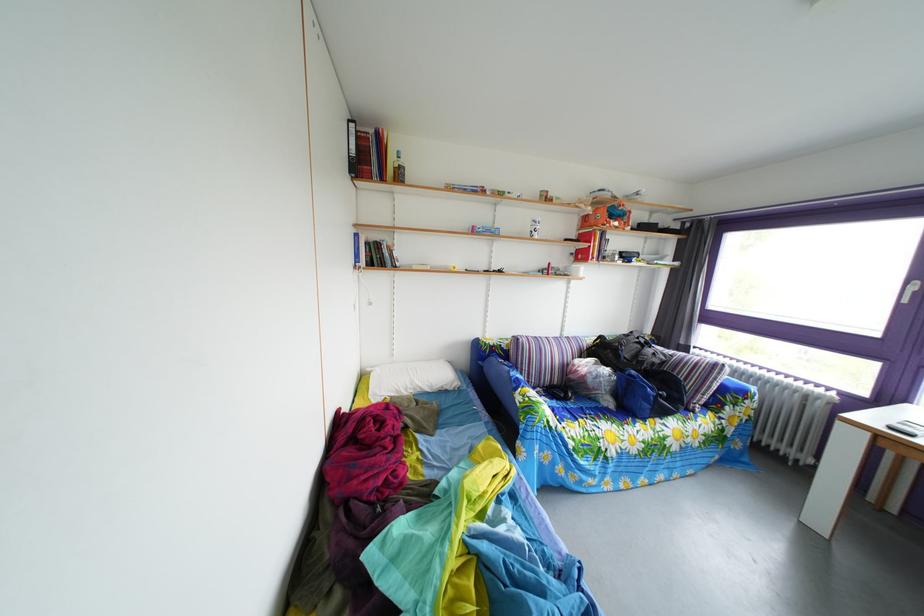
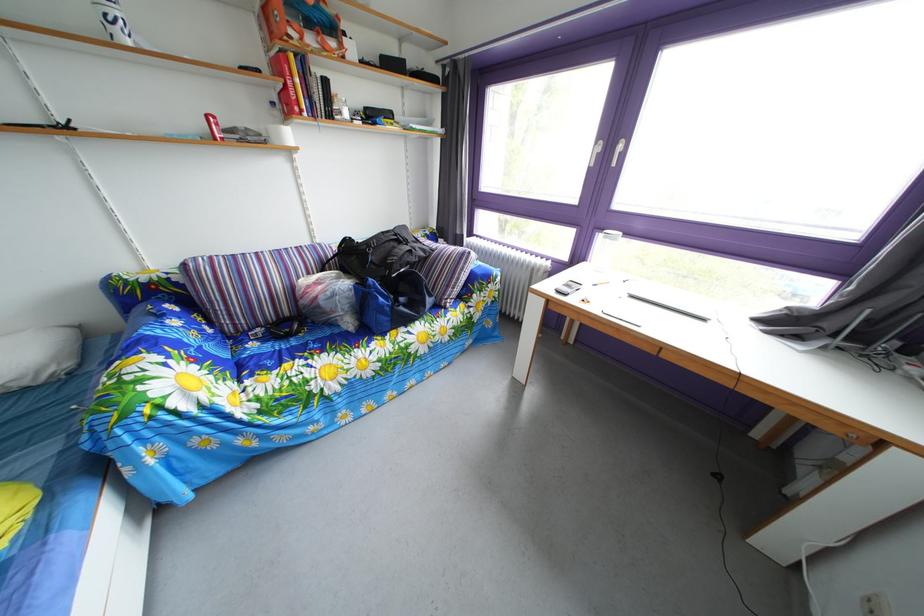
Locate, in the second image, the point that corresponds to (582,262) in the first image.

(284, 111)